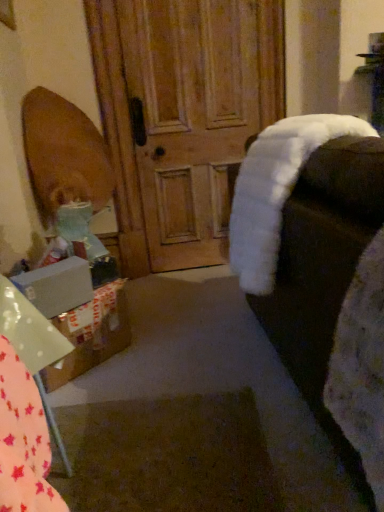
Question: From a real-world perspective, is white fluffy rocking chair at right located beneath wooden door at center?

Choices:
 (A) yes
 (B) no

Answer: (A)

Question: From a real-world perspective, is white fluffy rocking chair at right over wooden door at center?

Choices:
 (A) no
 (B) yes

Answer: (A)

Question: Is white fluffy rocking chair at right oriented away from wooden door at center?

Choices:
 (A) yes
 (B) no

Answer: (B)

Question: Can you confirm if white fluffy rocking chair at right is wider than wooden door at center?

Choices:
 (A) no
 (B) yes

Answer: (B)

Question: Does white fluffy rocking chair at right have a larger size compared to wooden door at center?

Choices:
 (A) no
 (B) yes

Answer: (B)

Question: From the image's perspective, is white fluffy rocking chair at right located beneath wooden door at center?

Choices:
 (A) yes
 (B) no

Answer: (A)

Question: Does wooden door at center appear on the right side of white fluffy rocking chair at right?

Choices:
 (A) no
 (B) yes

Answer: (A)

Question: Can you confirm if wooden door at center is shorter than white fluffy rocking chair at right?

Choices:
 (A) no
 (B) yes

Answer: (A)

Question: Would you say wooden door at center is a long distance from white fluffy rocking chair at right?

Choices:
 (A) yes
 (B) no

Answer: (A)

Question: From the image's perspective, is wooden door at center over white fluffy rocking chair at right?

Choices:
 (A) yes
 (B) no

Answer: (A)

Question: Is white fluffy rocking chair at right completely or partially inside wooden door at center?

Choices:
 (A) no
 (B) yes

Answer: (A)

Question: Is wooden door at center closer to the viewer compared to white fluffy rocking chair at right?

Choices:
 (A) yes
 (B) no

Answer: (B)

Question: Is white matte box at lower left placed right next to white cardboard box at lower left?

Choices:
 (A) no
 (B) yes

Answer: (A)